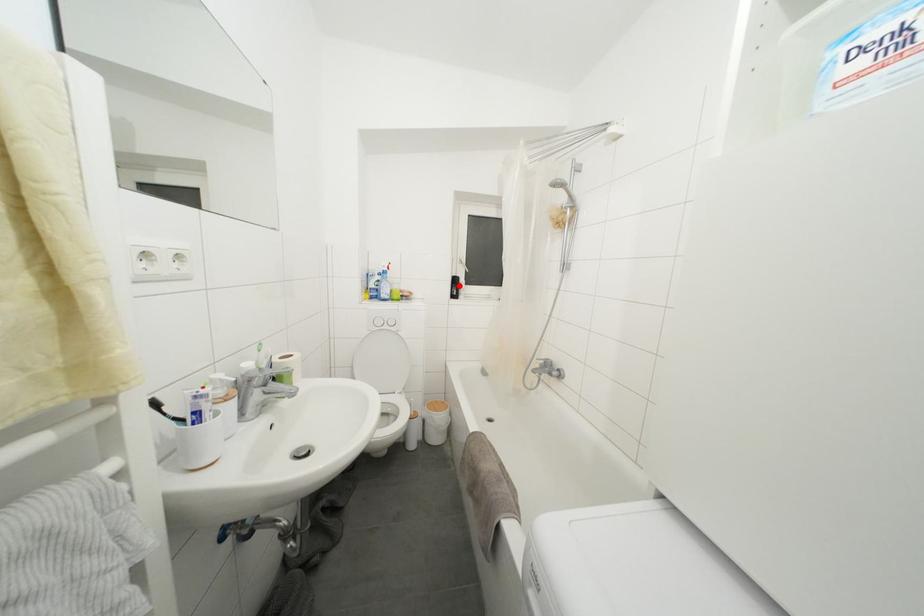
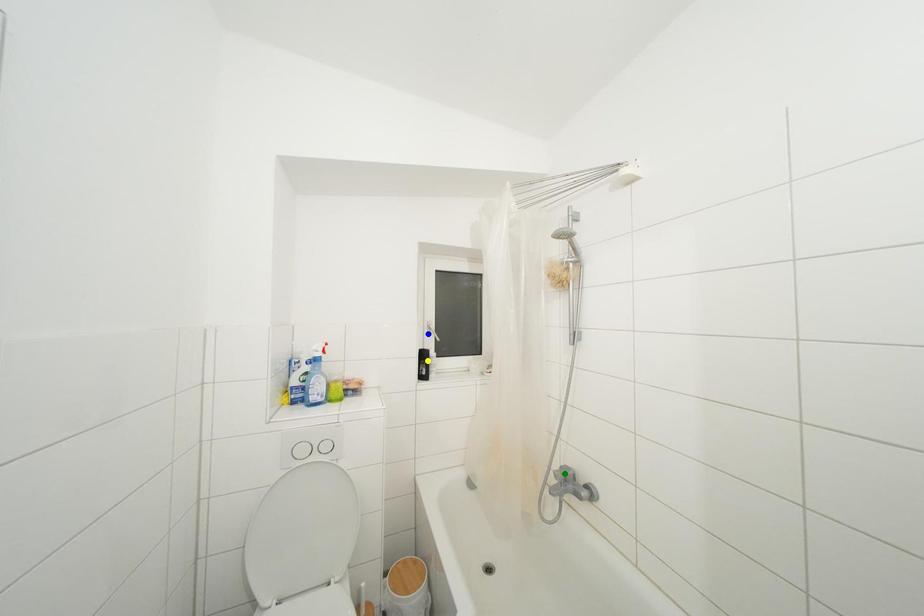
Question: I am providing you with two images of the same scene from different viewpoints. A red point is marked on the first image. You are given multiple points on the second image. Which mark in image 2 goes with the point in image 1?

Choices:
 (A) blue point
 (B) green point
 (C) yellow point

Answer: (C)